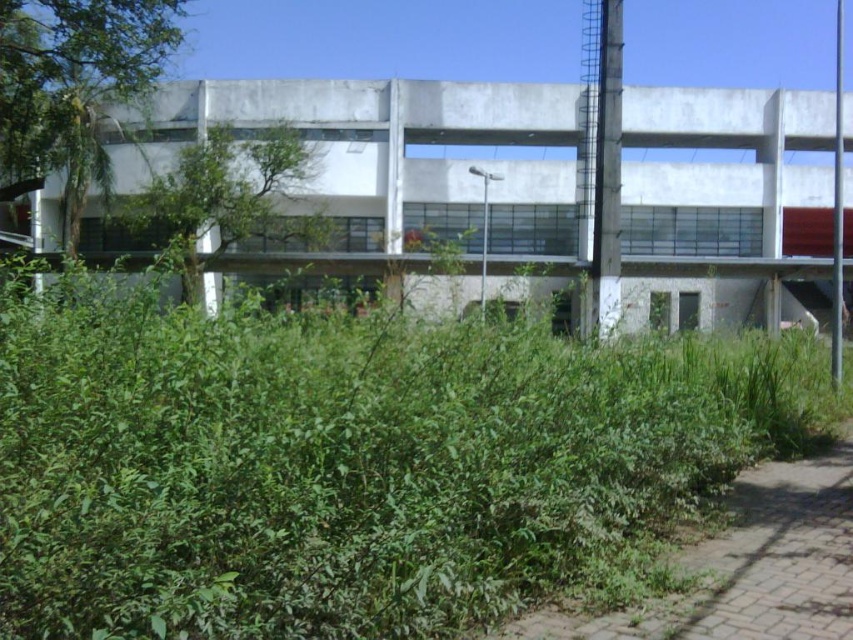
Question: Among these points, which one is nearest to the camera?

Choices:
 (A) (573, 374)
 (B) (732, 547)

Answer: (A)

Question: Can you confirm if green leafy bush at center is wider than green grass at lower right?

Choices:
 (A) no
 (B) yes

Answer: (B)

Question: Does green leafy bush at center have a greater width compared to green grass at lower right?

Choices:
 (A) no
 (B) yes

Answer: (B)

Question: Which of the following is the farthest from the observer?

Choices:
 (A) green grass at lower right
 (B) green leafy bush at center

Answer: (A)

Question: Among these points, which one is nearest to the camera?

Choices:
 (A) (813, 468)
 (B) (612, 570)

Answer: (B)

Question: Considering the relative positions of green leafy bush at center and green grass at lower right in the image provided, where is green leafy bush at center located with respect to green grass at lower right?

Choices:
 (A) right
 (B) left

Answer: (A)